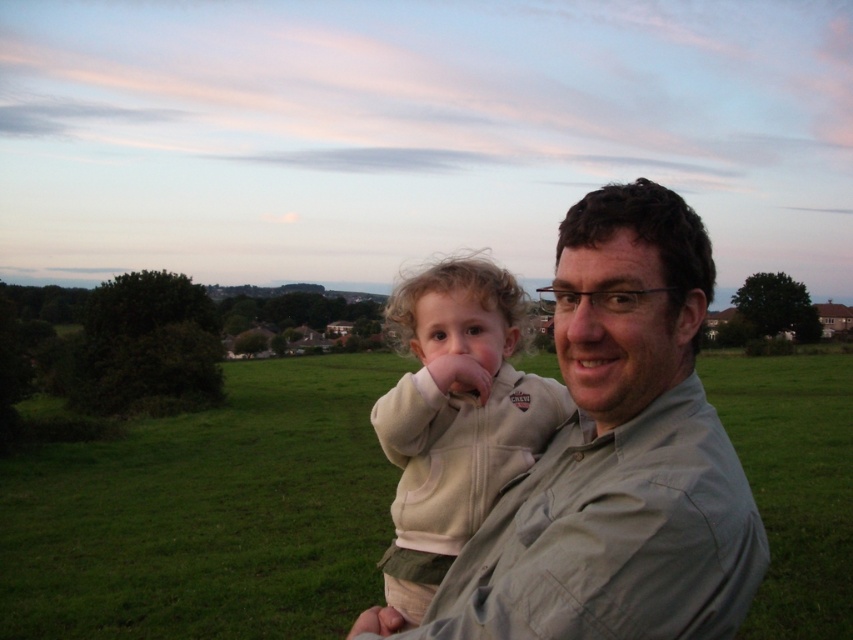
You are standing in the serene outdoor scene described. You notice the green grass at center and the light gray shirt at center. Which object is positioned lower in the image?

The green grass at center is located below the light gray shirt at center, so it is positioned lower in the image.

You are standing in the serene outdoor scene described. There is a point labeled at coordinates (207,515). What is located at that point?

The point at coordinates (207,515) indicates green grass at center.

You are a photographer standing in the scene and want to take a photo that focuses on the green grass at center and the light beige fleece at center. Which object should you adjust your camera focus to first if you want to ensure both are in focus?

The green grass at center is closer to the viewer than the light beige fleece at center, so you should focus on the green grass at center first to ensure both are in focus.